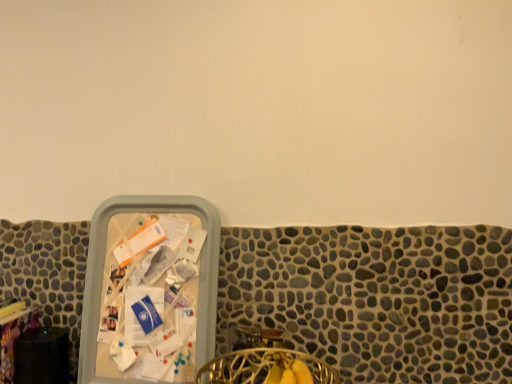
Measure the distance between point (222, 362) and camera.

Point (222, 362) is 3.65 feet away from camera.

Identify the location of gold wire basket at lower center. The image size is (512, 384). (262, 367).

What do you see at coordinates (262, 367) in the screenshot? The width and height of the screenshot is (512, 384). I see `gold wire basket at lower center` at bounding box center [262, 367].

What do you see at coordinates (13, 339) in the screenshot? I see `wooden table at lower left` at bounding box center [13, 339].

At what (x,y) coordinates should I click in order to perform the action: click on wooden table at lower left. Please return your answer as a coordinate pair (x, y). This screenshot has height=384, width=512. Looking at the image, I should click on [x=13, y=339].

Identify the location of gold wire basket at lower center. The height and width of the screenshot is (384, 512). (262, 367).

Is gold wire basket at lower center at the left side of wooden table at lower left?

In fact, gold wire basket at lower center is to the right of wooden table at lower left.

Based on the photo, does gold wire basket at lower center come in front of wooden table at lower left?

Yes, gold wire basket at lower center is in front of wooden table at lower left.

Which is further, (232, 364) or (8, 323)?

The point (8, 323) is farther.

Looking at this image, from the image's perspective, does gold wire basket at lower center appear higher than wooden table at lower left?

No, from the image's perspective, gold wire basket at lower center is not above wooden table at lower left.

From a real-world perspective, relative to wooden table at lower left, is gold wire basket at lower center vertically above or below?

From a real-world perspective, gold wire basket at lower center is physically below wooden table at lower left.

Looking at their sizes, would you say gold wire basket at lower center is wider or thinner than wooden table at lower left?

Clearly, gold wire basket at lower center has more width compared to wooden table at lower left.

Is gold wire basket at lower center shorter than wooden table at lower left?

Yes.

Considering the relative sizes of gold wire basket at lower center and wooden table at lower left in the image provided, is gold wire basket at lower center bigger than wooden table at lower left?

Indeed, gold wire basket at lower center has a larger size compared to wooden table at lower left.

Is gold wire basket at lower center inside the boundaries of wooden table at lower left, or outside?

The correct answer is: outside.

Is gold wire basket at lower center positioned far away from wooden table at lower left?

gold wire basket at lower center is near wooden table at lower left, not far away.

Is wooden table at lower left at the back of gold wire basket at lower center?

No.

The width and height of the screenshot is (512, 384). I want to click on table above the gold wire basket at lower center (from the image's perspective), so pyautogui.click(x=13, y=339).

Which is more to the right, wooden table at lower left or gold wire basket at lower center?

gold wire basket at lower center.

Which object is further away from the camera, wooden table at lower left or gold wire basket at lower center?

Positioned behind is wooden table at lower left.

Which point is more distant from viewer, [15,336] or [312,365]?

The point [15,336] is behind.

From the image's perspective, which object appears higher, wooden table at lower left or gold wire basket at lower center?

From the image's view, wooden table at lower left is above.

From a real-world perspective, which is physically above, wooden table at lower left or gold wire basket at lower center?

wooden table at lower left, from a real-world perspective.

Looking at this image, does wooden table at lower left have a greater width compared to gold wire basket at lower center?

No, wooden table at lower left is not wider than gold wire basket at lower center.

Considering the sizes of objects wooden table at lower left and gold wire basket at lower center in the image provided, who is taller, wooden table at lower left or gold wire basket at lower center?

wooden table at lower left.

Is wooden table at lower left smaller than gold wire basket at lower center?

Correct, wooden table at lower left occupies less space than gold wire basket at lower center.

Is gold wire basket at lower center inside wooden table at lower left?

No, gold wire basket at lower center is not a part of wooden table at lower left.

Would you say wooden table at lower left is a long distance from gold wire basket at lower center?

No, wooden table at lower left is not far from gold wire basket at lower center.

Does wooden table at lower left turn towards gold wire basket at lower center?

No.

This screenshot has height=384, width=512. In the image, there is a wooden table at lower left. What are the coordinates of `chair below it (from the image's perspective)` in the screenshot? It's located at (262, 367).

The height and width of the screenshot is (384, 512). I want to click on table located behind the gold wire basket at lower center, so click(13, 339).

The width and height of the screenshot is (512, 384). In the image, there is a wooden table at lower left. What are the coordinates of `chair below it (from the image's perspective)` in the screenshot? It's located at (262, 367).